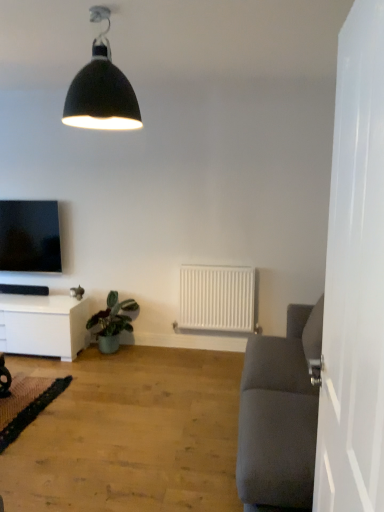
Question: From the image's perspective, is black matte lampshade at upper center above or below green matte plant at lower left?

Choices:
 (A) below
 (B) above

Answer: (B)

Question: Looking at the image, does black matte lampshade at upper center seem bigger or smaller compared to green matte plant at lower left?

Choices:
 (A) small
 (B) big

Answer: (A)

Question: Which object is positioned closest to the matte black tv at left?

Choices:
 (A) wooden floor at lower left
 (B) white matte radiator at center
 (C) black matte lampshade at upper center
 (D) white glossy door at right
 (E) green textured mat at lower left

Answer: (E)

Question: Which of these objects is positioned farthest from the green matte plant at lower left?

Choices:
 (A) black matte lampshade at upper center
 (B) white glossy cabinet at lower left
 (C) white glossy door at right
 (D) wooden floor at lower left
 (E) green textured mat at lower left

Answer: (C)